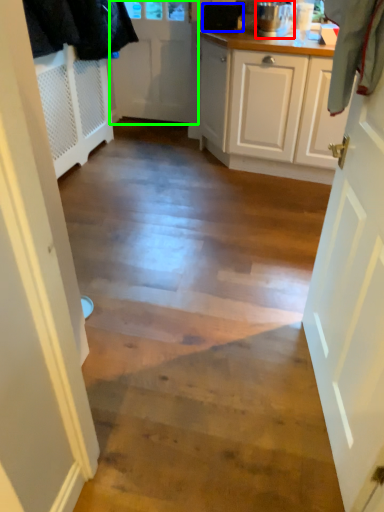
Question: Considering the real-world distances, which object is closest to kitchen appliance (highlighted by a red box)? appliance (highlighted by a blue box) or door (highlighted by a green box).

Choices:
 (A) appliance
 (B) door

Answer: (A)